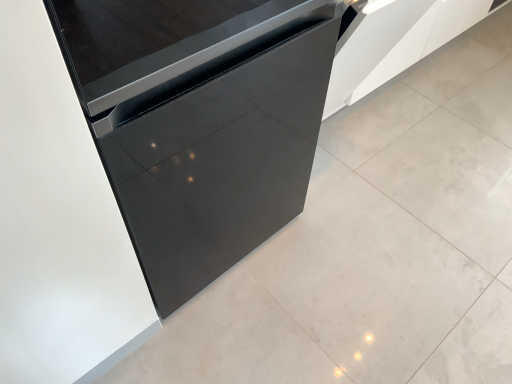
Locate an element on the screen. Image resolution: width=512 pixels, height=384 pixels. vacant space to the right of matte black dishwasher at center is located at coordinates (371, 240).